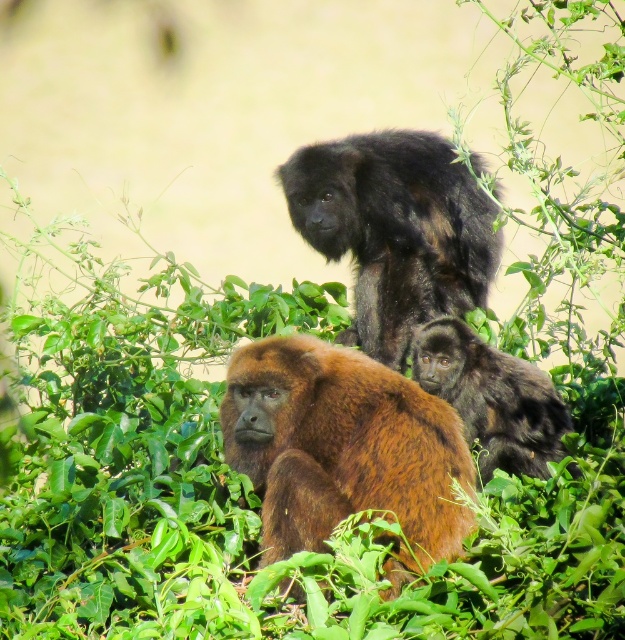
Who is more forward, (466, 445) or (460, 339)?

Point (466, 445) is more forward.

Which of these two, brown furry monkey at center or shiny black monkey at center, stands shorter?

Standing shorter between the two is shiny black monkey at center.

Image resolution: width=625 pixels, height=640 pixels. Find the location of `brown furry monkey at center`. brown furry monkey at center is located at coordinates (342, 449).

This screenshot has width=625, height=640. I want to click on brown furry monkey at center, so click(342, 449).

Based on the photo, which is more to the right, brown furry monkey at center or shiny black monkey at upper center?

Positioned to the right is shiny black monkey at upper center.

Is point (318, 452) in front of point (478, 253)?

Yes, point (318, 452) is closer to viewer.

You are a GUI agent. You are given a task and a screenshot of the screen. Output one action in this format:
    pyautogui.click(x=<x>, y=<y>)
    Task: Click on the brown furry monkey at center
    The height and width of the screenshot is (640, 625).
    Given the screenshot: What is the action you would take?
    pyautogui.click(x=342, y=449)

Looking at this image, between shiny black monkey at upper center and shiny black monkey at center, which one has more height?

With more height is shiny black monkey at upper center.

Is shiny black monkey at upper center thinner than shiny black monkey at center?

Incorrect, shiny black monkey at upper center's width is not less than shiny black monkey at center's.

Between point (312, 179) and point (512, 468), which one is positioned in front?

Point (512, 468) is in front.

Image resolution: width=625 pixels, height=640 pixels. I want to click on shiny black monkey at upper center, so tap(396, 230).